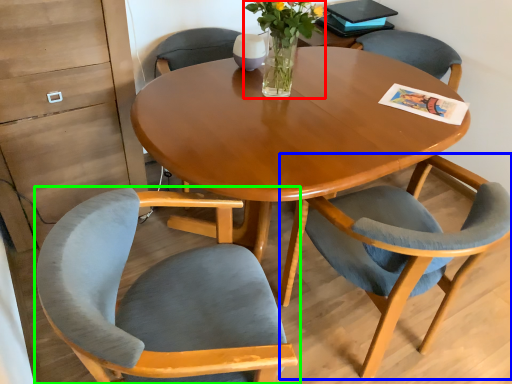
Question: Considering the real-world distances, which object is closest to floral arrangement (highlighted by a red box)? chair (highlighted by a blue box) or chair (highlighted by a green box).

Choices:
 (A) chair
 (B) chair

Answer: (A)